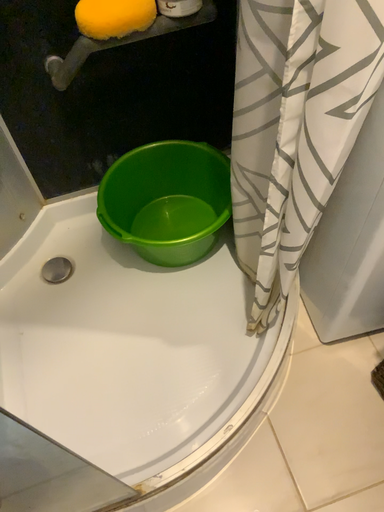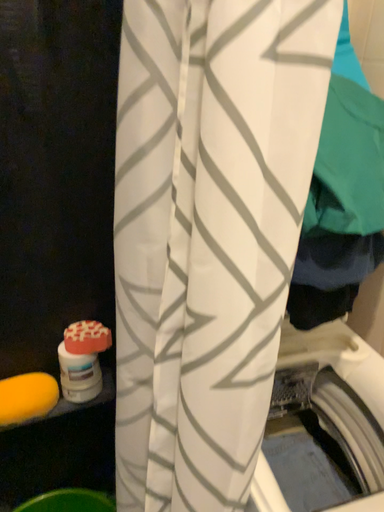
Question: How did the camera likely rotate when shooting the video?

Choices:
 (A) rotated downward
 (B) rotated upward

Answer: (B)